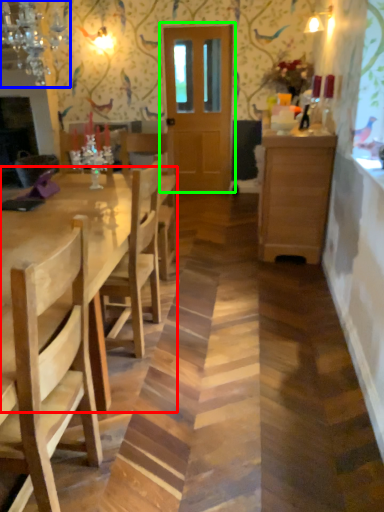
Question: Based on their relative distances, which object is nearer to kitchen & dining room table (highlighted by a red box)? Choose from light fixture (highlighted by a blue box) and door (highlighted by a green box).

Choices:
 (A) light fixture
 (B) door

Answer: (A)